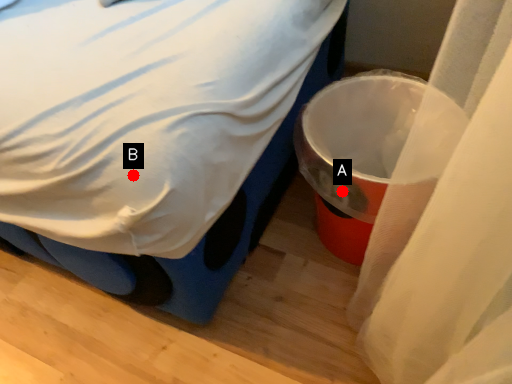
Question: Two points are circled on the image, labeled by A and B beside each circle. Which point is closer to the camera taking this photo?

Choices:
 (A) A is closer
 (B) B is closer

Answer: (B)